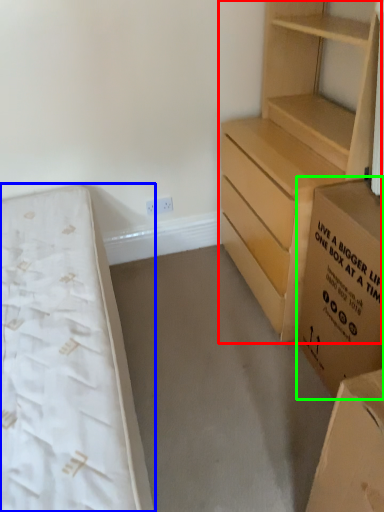
Question: Estimate the real-world distances between objects in this image. Which object is farther from chest of drawers (highlighted by a red box), bed (highlighted by a blue box) or cardboard box (highlighted by a green box)?

Choices:
 (A) bed
 (B) cardboard box

Answer: (A)